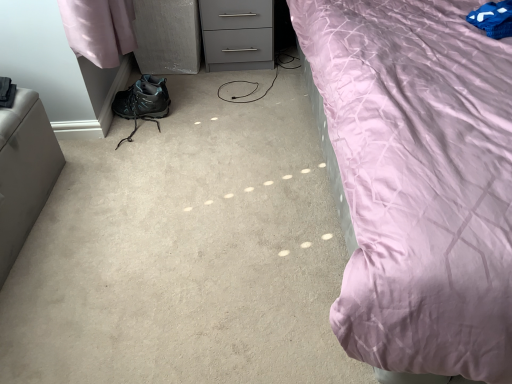
Question: Does matte black boot at lower left appear on the right side of matte black hiking boot at lower left?

Choices:
 (A) no
 (B) yes

Answer: (B)

Question: Would you say matte black boot at lower left is outside matte black hiking boot at lower left?

Choices:
 (A) no
 (B) yes

Answer: (B)

Question: Considering the relative sizes of matte black boot at lower left and matte black hiking boot at lower left in the image provided, is matte black boot at lower left shorter than matte black hiking boot at lower left?

Choices:
 (A) no
 (B) yes

Answer: (A)

Question: Are matte black boot at lower left and matte black hiking boot at lower left making contact?

Choices:
 (A) no
 (B) yes

Answer: (B)

Question: Is matte black boot at lower left thinner than matte black hiking boot at lower left?

Choices:
 (A) no
 (B) yes

Answer: (A)

Question: Considering the relative sizes of matte black boot at lower left and matte black hiking boot at lower left in the image provided, is matte black boot at lower left taller than matte black hiking boot at lower left?

Choices:
 (A) no
 (B) yes

Answer: (B)

Question: Is satin gray ottoman at left next to blue fabric pillow at upper right?

Choices:
 (A) yes
 (B) no

Answer: (B)

Question: Considering the relative sizes of satin gray ottoman at left and blue fabric pillow at upper right in the image provided, is satin gray ottoman at left thinner than blue fabric pillow at upper right?

Choices:
 (A) yes
 (B) no

Answer: (A)

Question: Does satin gray ottoman at left have a larger size compared to blue fabric pillow at upper right?

Choices:
 (A) no
 (B) yes

Answer: (B)

Question: Is blue fabric pillow at upper right located within satin gray ottoman at left?

Choices:
 (A) no
 (B) yes

Answer: (A)

Question: Does satin gray ottoman at left have a lesser height compared to blue fabric pillow at upper right?

Choices:
 (A) yes
 (B) no

Answer: (B)

Question: From the image's perspective, is satin gray ottoman at left located beneath blue fabric pillow at upper right?

Choices:
 (A) yes
 (B) no

Answer: (A)

Question: Does satin gray ottoman at left appear on the left side of matte black hiking boot at lower left?

Choices:
 (A) yes
 (B) no

Answer: (A)